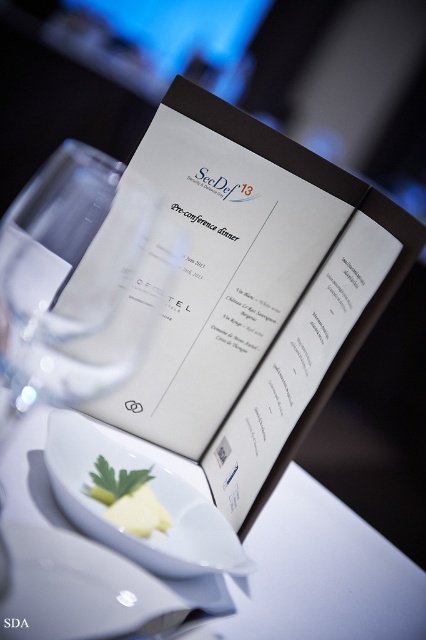
Question: Is white paper menu at center closer to camera compared to white glossy plate at center?

Choices:
 (A) yes
 (B) no

Answer: (B)

Question: Which object is the farthest from the white glossy bowl at center?

Choices:
 (A) white paper menu at center
 (B) white glossy plate at lower center

Answer: (A)

Question: Which object is farther from the camera taking this photo?

Choices:
 (A) white glossy plate at center
 (B) white glossy plate at lower center
 (C) white glossy bowl at center

Answer: (A)

Question: Can you confirm if white glossy bowl at center is positioned to the left of yellow butter at center?

Choices:
 (A) yes
 (B) no

Answer: (B)

Question: Which object is farther from the camera taking this photo?

Choices:
 (A) white glossy plate at center
 (B) white glossy plate at lower center

Answer: (A)

Question: Does white paper menu at center have a greater width compared to white glossy bowl at center?

Choices:
 (A) yes
 (B) no

Answer: (B)